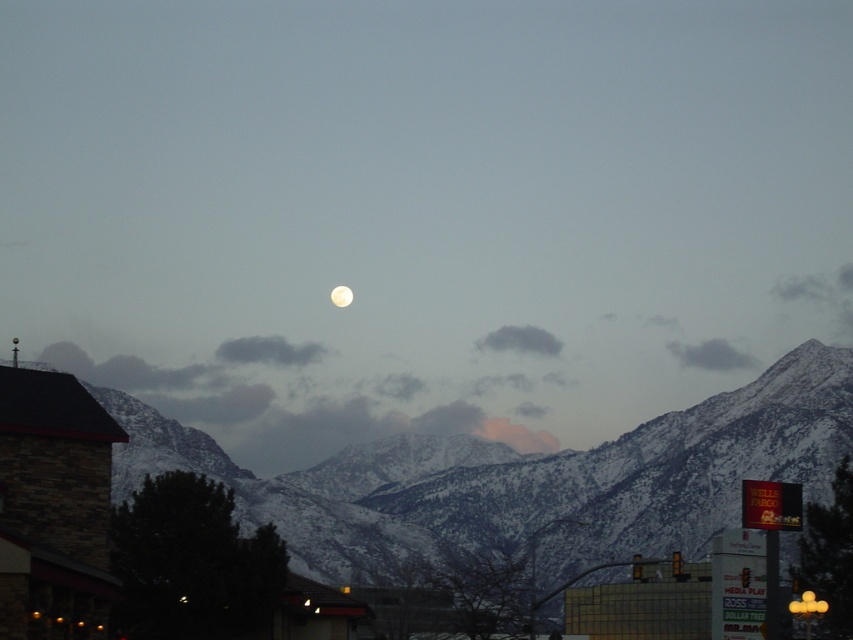
You are standing at the center of the image and want to look at the snowy mountain range at center. In which direction should you move your gaze?

The snowy mountain range at center is already at the center of the image, so you don not need to move your gaze.

You are an astronomer observing the night sky. You notice the snowy mountain range at center and the white glossy moon at upper center. Which object appears larger in the scene?

The snowy mountain range at center appears larger than the white glossy moon at upper center.